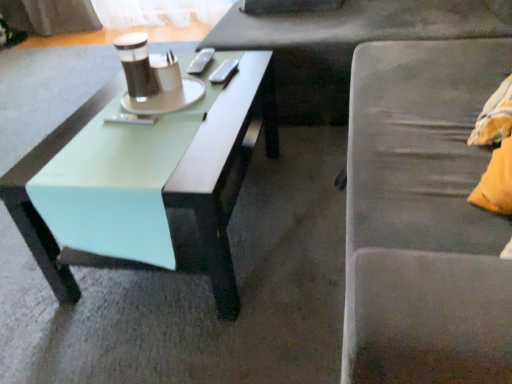
I want to click on free space to the left of silver metallic remote control at center, the 2th remote control in the top-to-bottom sequence, so click(x=186, y=77).